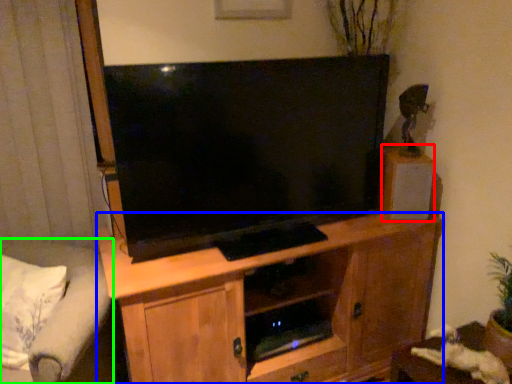
Question: Estimate the real-world distances between objects in this image. Which object is closer to loudspeaker (highlighted by a red box), cabinetry (highlighted by a blue box) or studio couch (highlighted by a green box)?

Choices:
 (A) cabinetry
 (B) studio couch

Answer: (A)